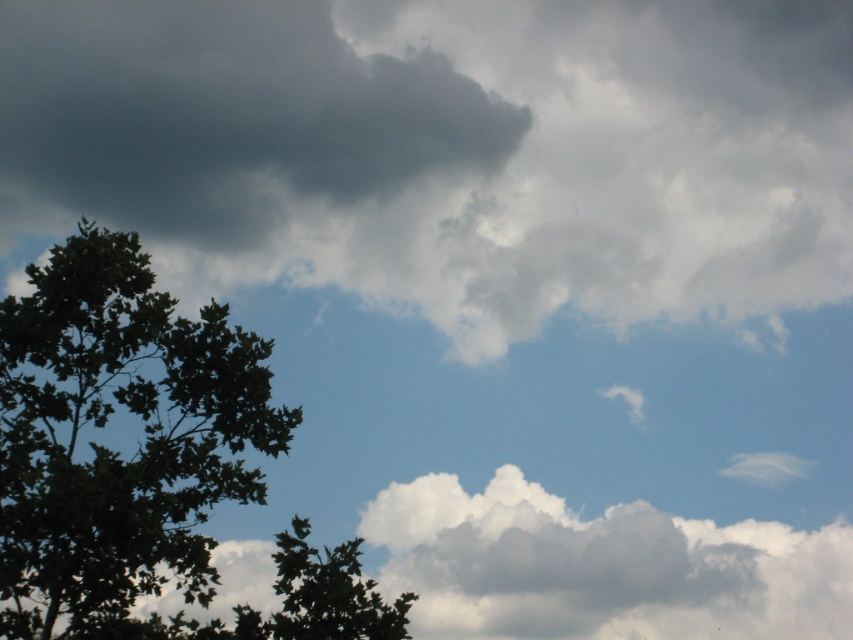
Question: Does dark gray fluffy cloud at upper left appear under green leafy tree at upper left?

Choices:
 (A) no
 (B) yes

Answer: (A)

Question: Is dark gray fluffy cloud at upper left above green leafy tree at upper left?

Choices:
 (A) no
 (B) yes

Answer: (B)

Question: Which point is closer to the camera?

Choices:
 (A) dark gray fluffy cloud at upper left
 (B) green leafy tree at upper left
 (C) white fluffy cloud at center

Answer: (B)

Question: Which of the following is the farthest from the observer?

Choices:
 (A) green leafy tree at left
 (B) white fluffy cloud at center
 (C) dark gray fluffy cloud at upper left
 (D) green leafy tree at upper left

Answer: (C)

Question: Which object is closer to the camera taking this photo?

Choices:
 (A) dark gray fluffy cloud at upper left
 (B) green leafy tree at upper left
 (C) green leafy tree at left

Answer: (C)

Question: Is dark gray fluffy cloud at upper left to the right of white fluffy cloud at center from the viewer's perspective?

Choices:
 (A) no
 (B) yes

Answer: (A)